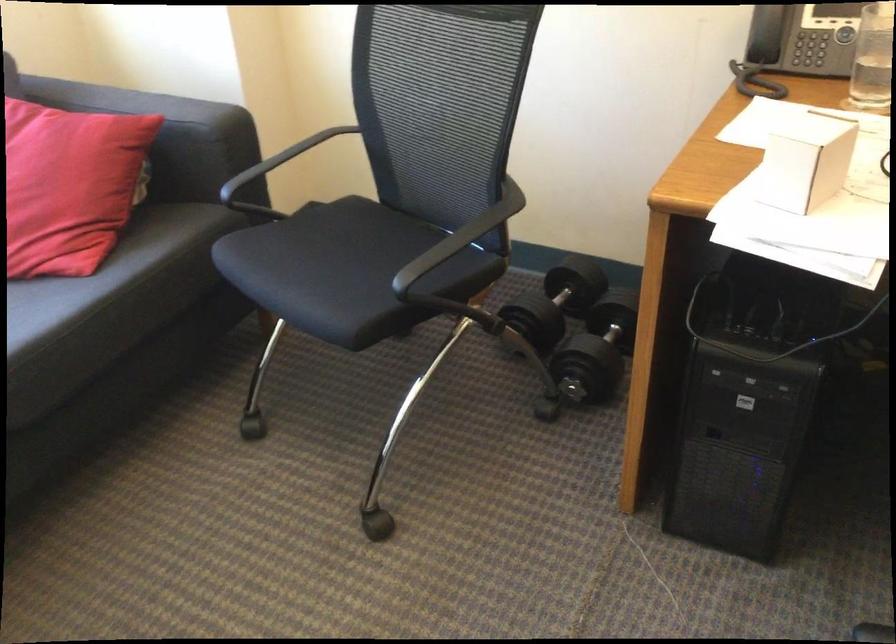
Which object does [872,59] point to?

It refers to a water glass.